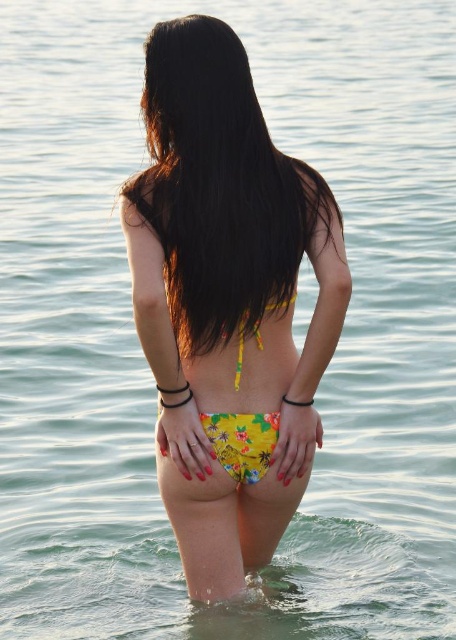
Who is positioned more to the right, yellow floral bikini bottom at center or yellow floral fabric bikini top at center?

From the viewer's perspective, yellow floral fabric bikini top at center appears more on the right side.

Is point (243, 316) positioned in front of point (249, 332)?

Yes.

Image resolution: width=456 pixels, height=640 pixels. In order to click on yellow floral bikini bottom at center in this screenshot , I will do `click(227, 301)`.